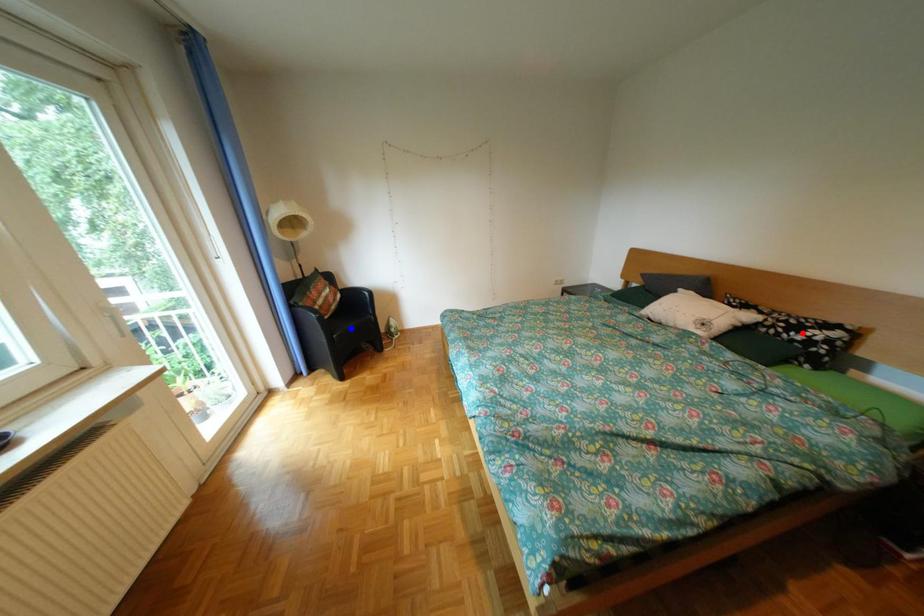
Question: In the image, two points are highlighted. Which point is nearer to the camera? Reply with the corresponding letter.

Choices:
 (A) blue point
 (B) red point

Answer: (B)